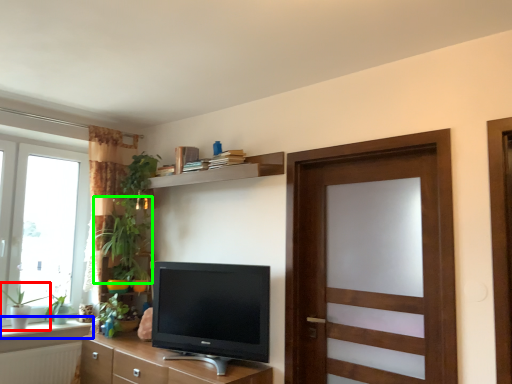
Question: Based on their relative distances, which object is farther from plant (highlighted by a red box)? Choose from window sill (highlighted by a blue box) and plant (highlighted by a green box).

Choices:
 (A) window sill
 (B) plant

Answer: (B)